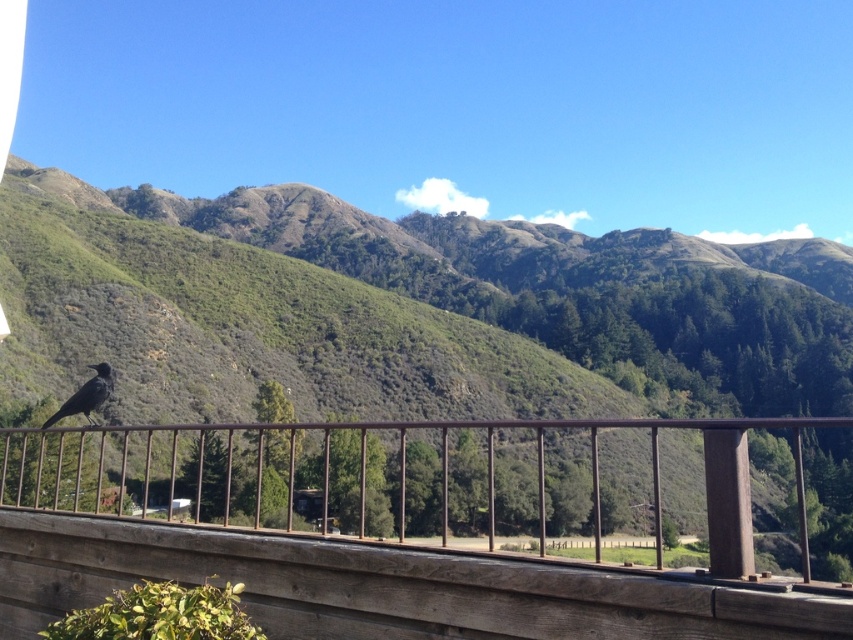
Question: Does green textured hillside at center appear over shiny black bird at lower left?

Choices:
 (A) no
 (B) yes

Answer: (B)

Question: Does brown wooden balcony at lower left have a larger size compared to shiny black bird at lower left?

Choices:
 (A) no
 (B) yes

Answer: (B)

Question: Among these points, which one is farthest from the camera?

Choices:
 (A) (90, 417)
 (B) (305, 275)

Answer: (B)

Question: Estimate the real-world distances between objects in this image. Which object is closer to the green textured hillside at center?

Choices:
 (A) shiny black bird at lower left
 (B) brown wooden balcony at lower left

Answer: (B)

Question: Is green textured hillside at center thinner than brown wooden balcony at lower left?

Choices:
 (A) yes
 (B) no

Answer: (B)

Question: Among these objects, which one is nearest to the camera?

Choices:
 (A) shiny black bird at lower left
 (B) green textured hillside at center

Answer: (A)